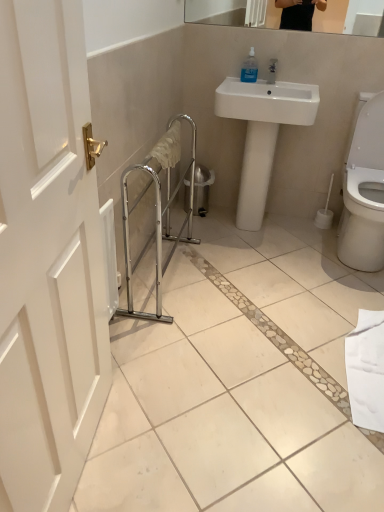
Question: Can you confirm if chrome metallic balustrade at center is smaller than transparent plastic soap dispenser at upper center?

Choices:
 (A) yes
 (B) no

Answer: (B)

Question: Considering the relative sizes of chrome metallic balustrade at center and transparent plastic soap dispenser at upper center in the image provided, is chrome metallic balustrade at center shorter than transparent plastic soap dispenser at upper center?

Choices:
 (A) no
 (B) yes

Answer: (A)

Question: From the image's perspective, is chrome metallic balustrade at center located beneath transparent plastic soap dispenser at upper center?

Choices:
 (A) yes
 (B) no

Answer: (A)

Question: Is chrome metallic balustrade at center to the left of transparent plastic soap dispenser at upper center from the viewer's perspective?

Choices:
 (A) yes
 (B) no

Answer: (A)

Question: Considering the relative sizes of chrome metallic balustrade at center and transparent plastic soap dispenser at upper center in the image provided, is chrome metallic balustrade at center taller than transparent plastic soap dispenser at upper center?

Choices:
 (A) yes
 (B) no

Answer: (A)

Question: Is point (276, 102) positioned closer to the camera than point (158, 245)?

Choices:
 (A) closer
 (B) farther

Answer: (A)

Question: Would you say white glossy sink at center is to the left or to the right of chrome metallic balustrade at center in the picture?

Choices:
 (A) right
 (B) left

Answer: (A)

Question: Is white glossy sink at center in front of or behind chrome metallic balustrade at center in the image?

Choices:
 (A) behind
 (B) front

Answer: (A)

Question: Is white glossy sink at center spatially inside chrome metallic balustrade at center, or outside of it?

Choices:
 (A) inside
 (B) outside

Answer: (B)

Question: From a real-world perspective, is white glossy sink at center physically located above or below transparent plastic soap dispenser at upper center?

Choices:
 (A) below
 (B) above

Answer: (A)

Question: Would you say white glossy sink at center is inside or outside transparent plastic soap dispenser at upper center?

Choices:
 (A) inside
 (B) outside

Answer: (B)

Question: Based on their positions, is white glossy sink at center located to the left or right of transparent plastic soap dispenser at upper center?

Choices:
 (A) right
 (B) left

Answer: (A)

Question: Considering their positions, is white glossy sink at center located in front of or behind transparent plastic soap dispenser at upper center?

Choices:
 (A) behind
 (B) front

Answer: (B)

Question: Choose the correct answer: Is chrome metallic balustrade at center inside transparent plastic soap dispenser at upper center or outside it?

Choices:
 (A) outside
 (B) inside

Answer: (A)

Question: In terms of height, does chrome metallic balustrade at center look taller or shorter compared to transparent plastic soap dispenser at upper center?

Choices:
 (A) short
 (B) tall

Answer: (B)